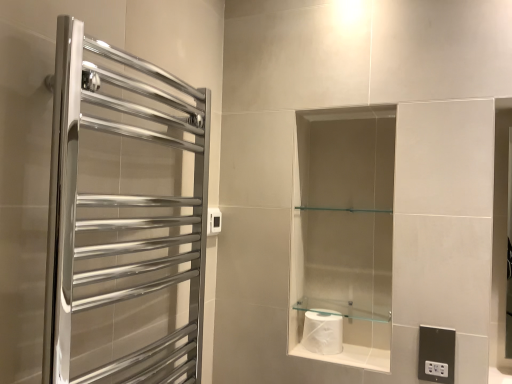
Where is `free space above white glossy toilet paper at lower center (from a real-world perspective)`? free space above white glossy toilet paper at lower center (from a real-world perspective) is located at coordinates (336, 342).